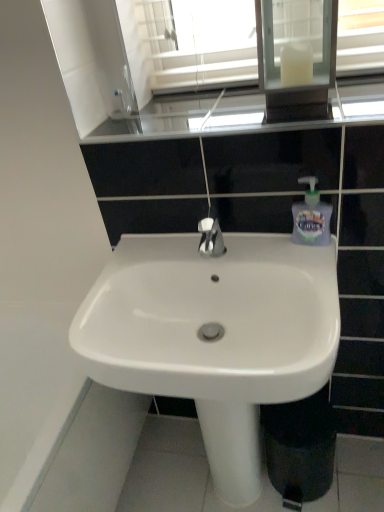
Find the location of a particular element. Image resolution: width=384 pixels, height=512 pixels. vacant region in front of translucent plastic soap dispenser at right is located at coordinates (315, 267).